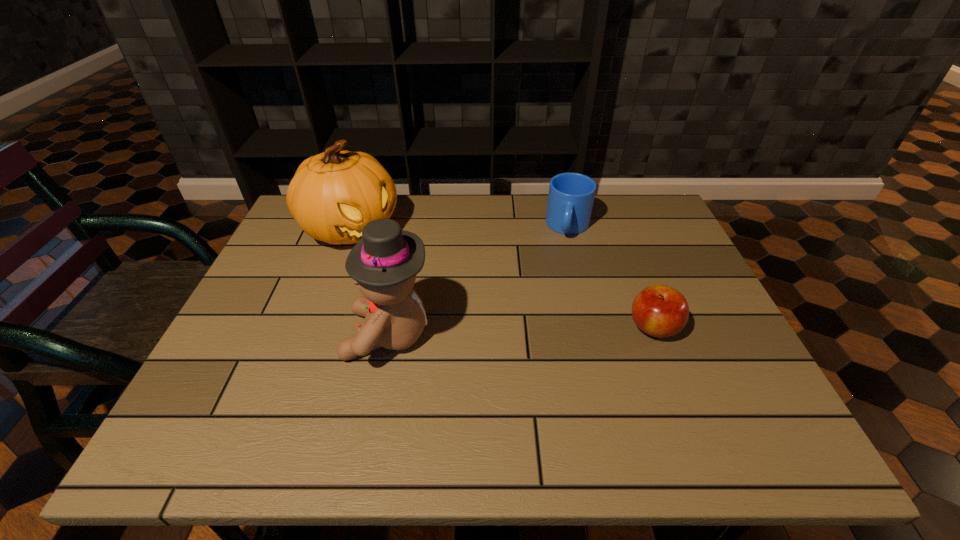
This screenshot has height=540, width=960. In order to click on object present at the near edge in this screenshot , I will do `click(384, 263)`.

You are a GUI agent. You are given a task and a screenshot of the screen. Output one action in this format:
    pyautogui.click(x=<x>, y=<y>)
    Task: Click on the object at the left edge
    This screenshot has height=540, width=960.
    Given the screenshot: What is the action you would take?
    pyautogui.click(x=333, y=195)

Find the location of a particular element. The height and width of the screenshot is (540, 960). object present at the right edge is located at coordinates (661, 311).

Find the location of a particular element. This screenshot has width=960, height=540. object present at the far left corner is located at coordinates (333, 195).

This screenshot has height=540, width=960. I want to click on vacant space at the far edge of the desktop, so click(498, 238).

In order to click on vacant space at the near edge of the desktop in this screenshot , I will do `click(423, 373)`.

I want to click on free region at the left edge of the desktop, so click(286, 315).

You are a GUI agent. You are given a task and a screenshot of the screen. Output one action in this format:
    pyautogui.click(x=<x>, y=<y>)
    Task: Click on the vacant space at the right edge of the desktop
    The width and height of the screenshot is (960, 540).
    Given the screenshot: What is the action you would take?
    pyautogui.click(x=696, y=280)

You are a GUI agent. You are given a task and a screenshot of the screen. Output one action in this format:
    pyautogui.click(x=<x>, y=<y>)
    Task: Click on the free space at the near left corner
    The width and height of the screenshot is (960, 540).
    Given the screenshot: What is the action you would take?
    pyautogui.click(x=229, y=386)

You are a GUI agent. You are given a task and a screenshot of the screen. Output one action in this format:
    pyautogui.click(x=<x>, y=<y>)
    Task: Click on the free space at the far right corner
    The image size is (960, 540).
    Given the screenshot: What is the action you would take?
    pyautogui.click(x=622, y=210)